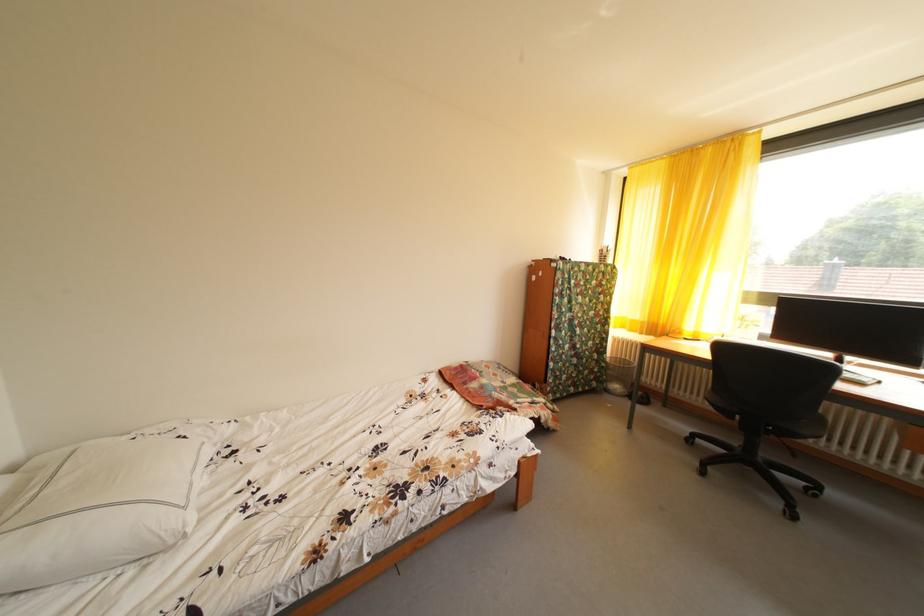
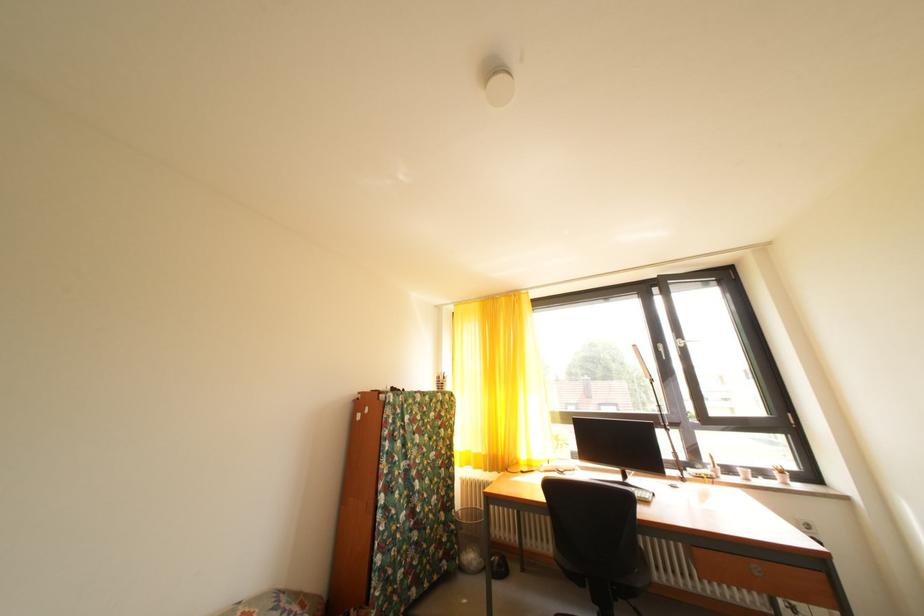
Find the pixel in the second image that matches the point at 613,371 in the first image.

(462, 533)